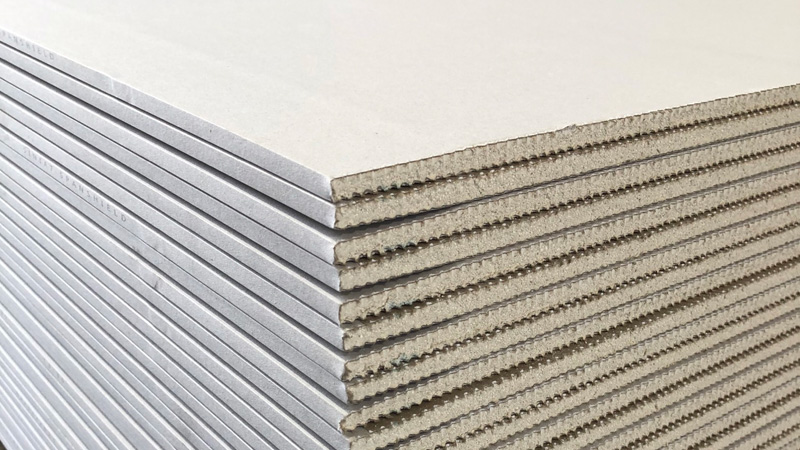
Find the location of a particular element. The width and height of the screenshot is (800, 450). sheet #5 is located at coordinates (261, 270).